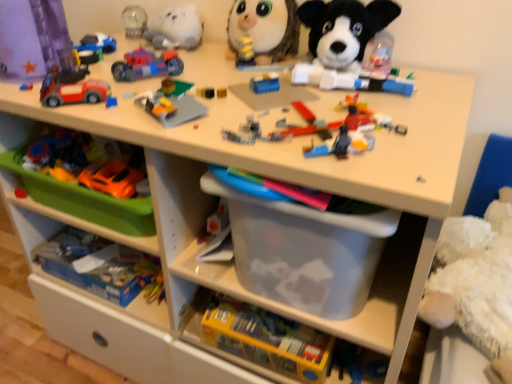
Question: Is the position of orange matte car at left, acting as the seventh toy starting from the top, less distant than that of matte plastic car at upper left, positioned as the 5th toy in bottom-to-top order?

Choices:
 (A) no
 (B) yes

Answer: (A)

Question: From the image's perspective, is orange matte car at left, which appears as the 3th toy when ordered from the bottom, located beneath matte plastic car at upper left, positioned as the 5th toy in bottom-to-top order?

Choices:
 (A) yes
 (B) no

Answer: (A)

Question: Is matte plastic car at upper left, positioned as the 5th toy in bottom-to-top order, at the back of orange matte car at left, which appears as the 3th toy when ordered from the bottom?

Choices:
 (A) no
 (B) yes

Answer: (A)

Question: Considering the relative sizes of orange matte car at left, acting as the seventh toy starting from the top, and matte plastic car at upper left, positioned as the 5th toy in bottom-to-top order, in the image provided, is orange matte car at left, acting as the seventh toy starting from the top, bigger than matte plastic car at upper left, positioned as the 5th toy in bottom-to-top order,?

Choices:
 (A) yes
 (B) no

Answer: (A)

Question: Is orange matte car at left, acting as the seventh toy starting from the top, located outside matte plastic car at upper left, positioned as the 5th toy in bottom-to-top order?

Choices:
 (A) no
 (B) yes

Answer: (B)

Question: From a real-world perspective, is blue cardboard box at lower left, arranged as the 2th toy when ordered from the bottom, physically located above or below green plastic tray at lower left?

Choices:
 (A) below
 (B) above

Answer: (A)

Question: Is blue cardboard box at lower left, marked as the 8th toy in a top-to-bottom arrangement, inside the boundaries of green plastic tray at lower left, or outside?

Choices:
 (A) inside
 (B) outside

Answer: (B)

Question: Relative to green plastic tray at lower left, is blue cardboard box at lower left, arranged as the 2th toy when ordered from the bottom, in front or behind?

Choices:
 (A) behind
 (B) front

Answer: (A)

Question: Visually, is blue cardboard box at lower left, arranged as the 2th toy when ordered from the bottom, positioned to the left or to the right of green plastic tray at lower left?

Choices:
 (A) right
 (B) left

Answer: (B)

Question: Is point (140, 57) positioned closer to the camera than point (122, 175)?

Choices:
 (A) closer
 (B) farther

Answer: (A)

Question: Is translucent plastic motorcycle at upper center, which ranks as the 6th toy in bottom-to-top order, spatially inside orange matte car at left, which appears as the 3th toy when ordered from the bottom, or outside of it?

Choices:
 (A) inside
 (B) outside

Answer: (B)

Question: Is translucent plastic motorcycle at upper center, which ranks as the 6th toy in bottom-to-top order, in front of or behind orange matte car at left, acting as the seventh toy starting from the top, in the image?

Choices:
 (A) front
 (B) behind

Answer: (B)

Question: From a real-world perspective, is translucent plastic motorcycle at upper center, placed as the fourth toy when sorted from top to bottom, positioned above or below orange matte car at left, which appears as the 3th toy when ordered from the bottom?

Choices:
 (A) above
 (B) below

Answer: (A)

Question: From the image's perspective, is translucent plastic motorcycle at upper center, which ranks as the 6th toy in bottom-to-top order, located above or below soft plush dog at upper center, which is the seventh toy from bottom to top?

Choices:
 (A) below
 (B) above

Answer: (A)

Question: In terms of height, does translucent plastic motorcycle at upper center, placed as the fourth toy when sorted from top to bottom, look taller or shorter compared to soft plush dog at upper center, which is the 3th toy in top-to-bottom order?

Choices:
 (A) short
 (B) tall

Answer: (A)